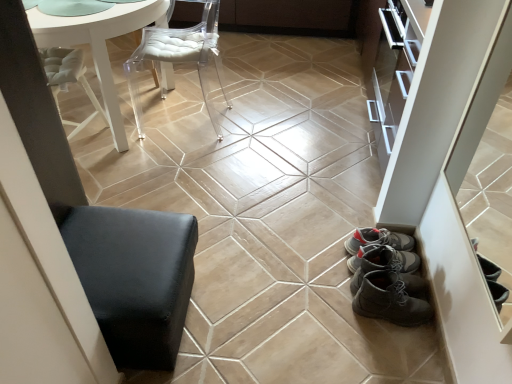
Find the location of `vacant area to the right of black leather ottoman at lower left`. vacant area to the right of black leather ottoman at lower left is located at coordinates (245, 314).